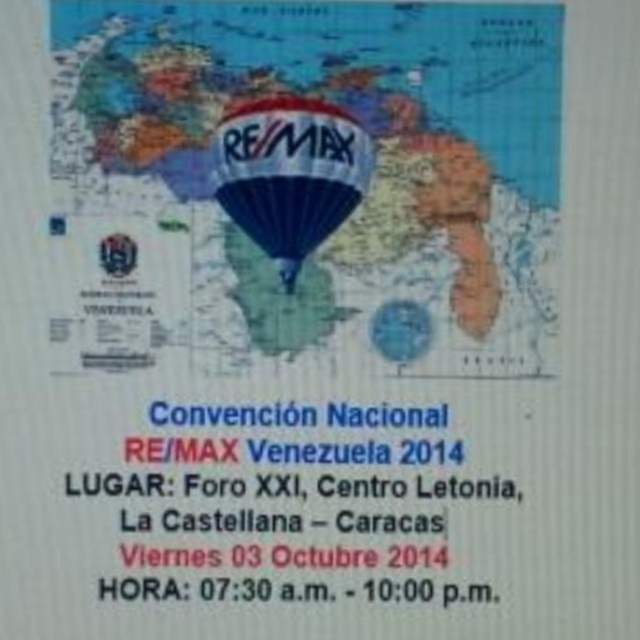
Looking at the promotional poster for the Convencion Nacional RE MAX Venezuela 2014, you notice the map at center and the blue glossy balloon at center. Which object takes up more horizontal space in the poster?

The map at center has a larger width than the blue glossy balloon at center, so the map at center takes up more horizontal space.

You are looking at the promotional poster for the Convencion Nacional RE MAX Venezuela 2014. There is a point at coordinates (308,186). What does this point indicate?

The point at coordinates (308,186) indicates the map at center.